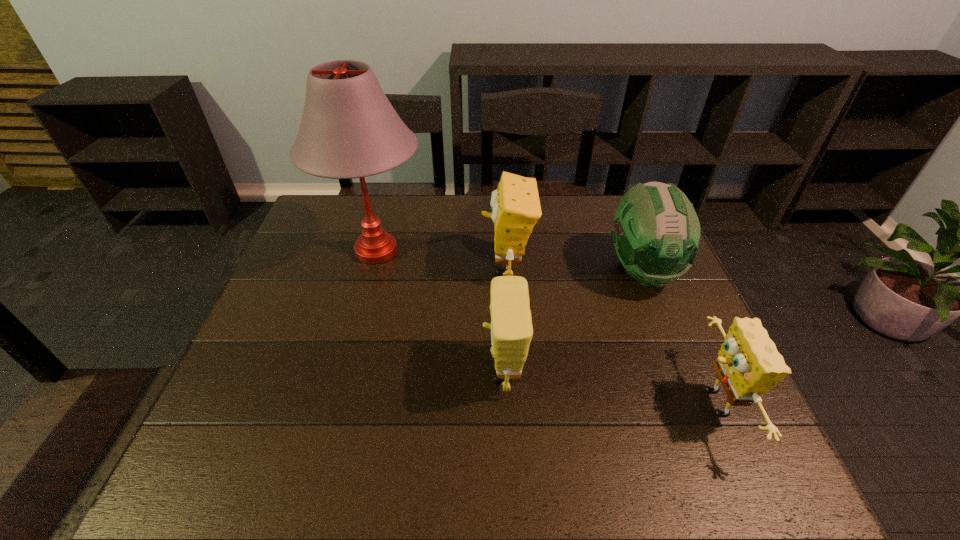
Where is `vacant space in between the farthest sponge and the rightmost sponge`? Image resolution: width=960 pixels, height=540 pixels. vacant space in between the farthest sponge and the rightmost sponge is located at coordinates (610, 334).

At what (x,y) coordinates should I click in order to perform the action: click on empty space that is in between the farthest sponge and the rightmost sponge. Please return your answer as a coordinate pair (x, y). This screenshot has height=540, width=960. Looking at the image, I should click on (610, 334).

Identify which object is located as the second nearest to the football helmet. Please provide its 2D coordinates. Your answer should be formatted as a tuple, i.e. [(x, y)], where the tuple contains the x and y coordinates of a point satisfying the conditions above.

[(515, 206)]

Image resolution: width=960 pixels, height=540 pixels. Identify the location of object that is the second closest one to the farthest sponge. (511, 327).

Identify the location of sponge identified as the second closest to the football helmet. (515, 206).

Where is `sponge that is the third closest to the tallest object`? sponge that is the third closest to the tallest object is located at coordinates (748, 365).